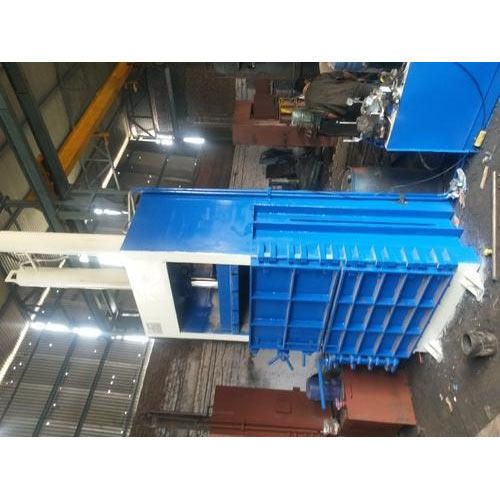
I want to click on ceiling, so click(x=52, y=117).